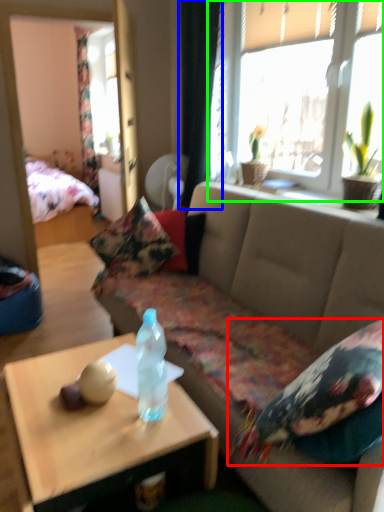
Question: Considering the real-world distances, which object is farthest from pillow (highlighted by a red box)? curtain (highlighted by a blue box) or window (highlighted by a green box)?

Choices:
 (A) curtain
 (B) window

Answer: (A)